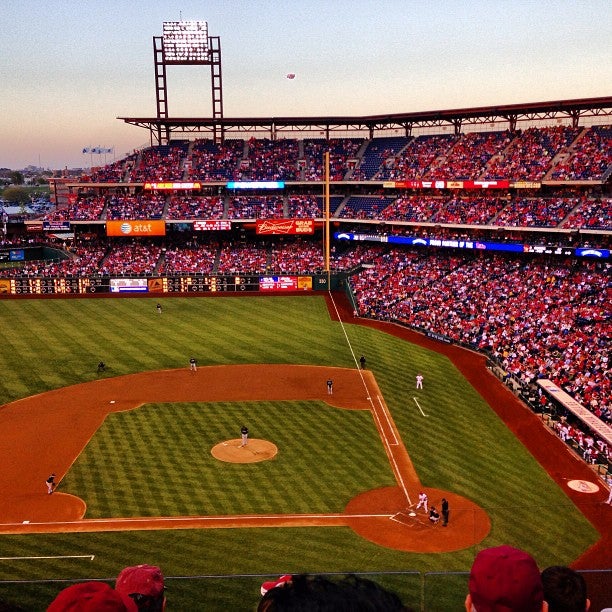
Identify the location of pitcher. This screenshot has height=612, width=612. (245, 433).